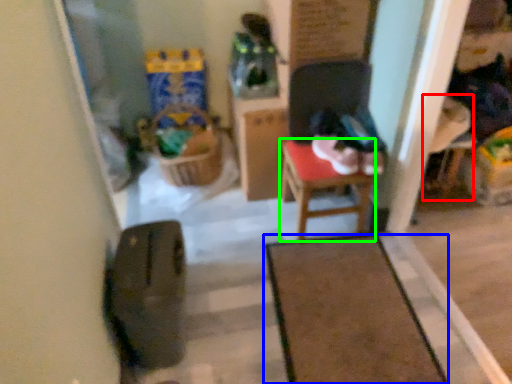
Question: Estimate the real-world distances between objects in this image. Which object is closer to armchair (highlighted by a red box), furniture (highlighted by a blue box) or table (highlighted by a green box)?

Choices:
 (A) furniture
 (B) table

Answer: (B)